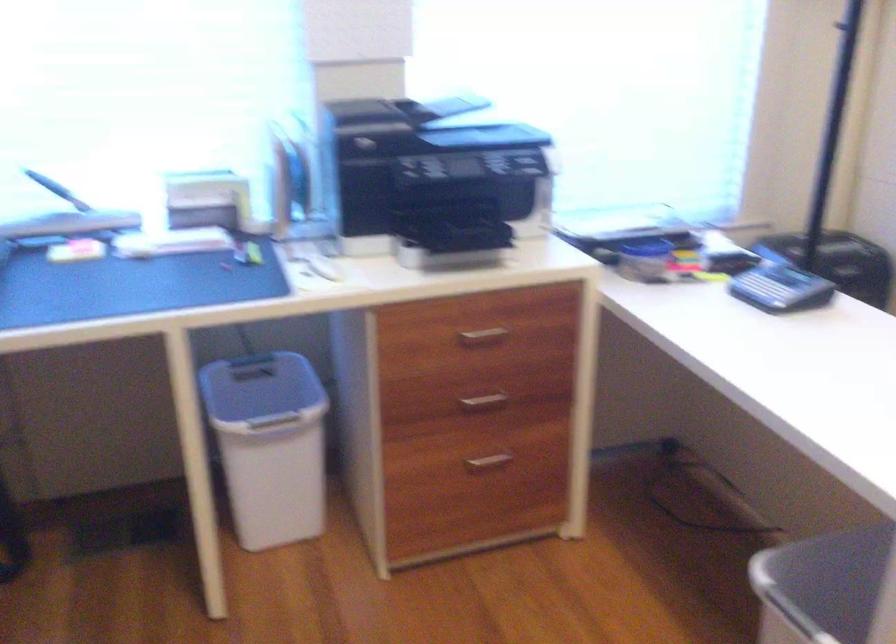
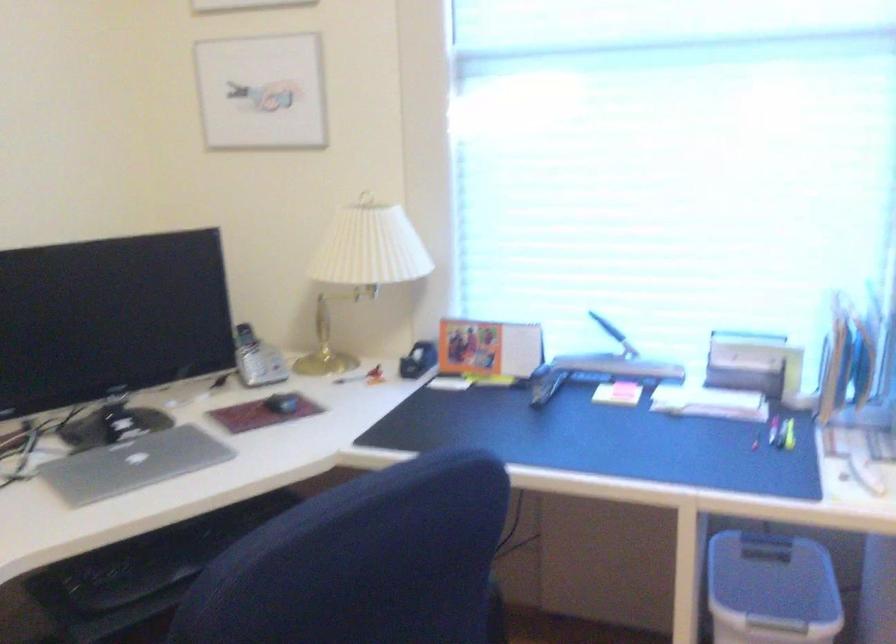
Question: The images are taken continuously from a first-person perspective. In which direction is your viewpoint rotating?

Choices:
 (A) Left
 (B) Right
 (C) Up
 (D) Down

Answer: (A)